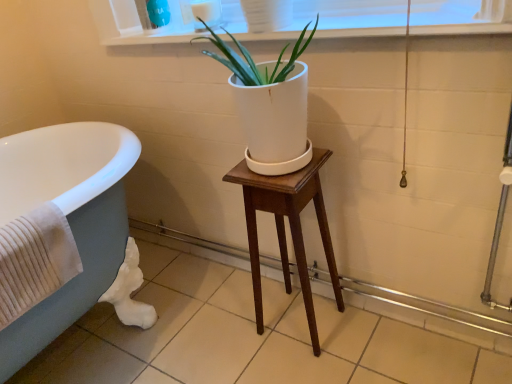
Find the location of a particular element. vacant space in front of mahogany wood stool at center is located at coordinates (321, 368).